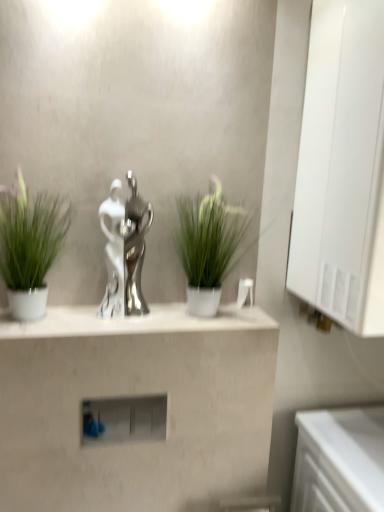
Where is `free space in front of silver metallic trophy at center`? The height and width of the screenshot is (512, 384). free space in front of silver metallic trophy at center is located at coordinates (115, 323).